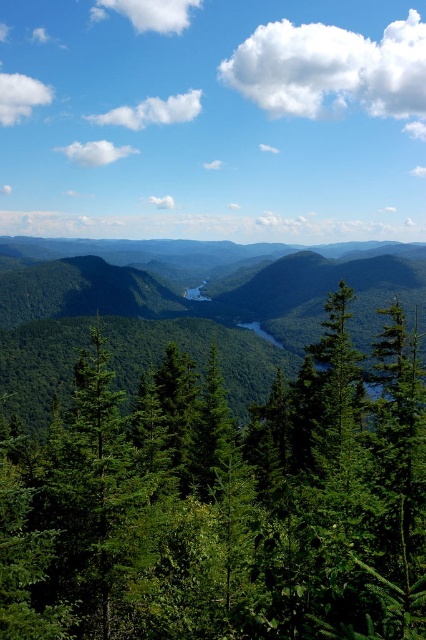
Question: Which point is closer to the camera?

Choices:
 (A) (351, 352)
 (B) (14, 374)

Answer: (A)

Question: Which object appears farthest from the camera in this image?

Choices:
 (A) green matte forest at center
 (B) green matte tree at center

Answer: (A)

Question: Is green matte tree at center below green matte forest at center?

Choices:
 (A) yes
 (B) no

Answer: (A)

Question: Does green matte tree at center come behind green matte forest at center?

Choices:
 (A) yes
 (B) no

Answer: (B)

Question: Observing the image, what is the correct spatial positioning of green matte tree at center in reference to green matte forest at center?

Choices:
 (A) left
 (B) right

Answer: (A)